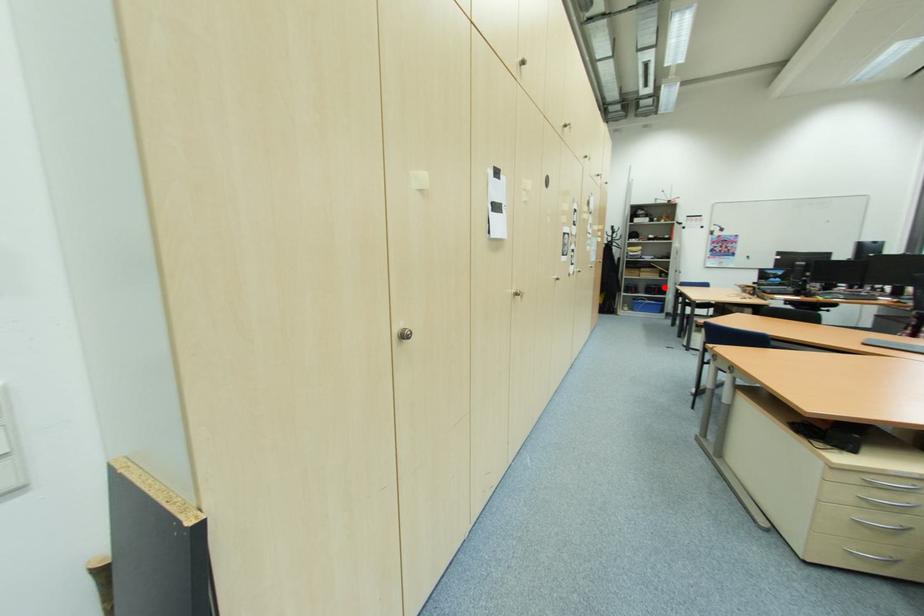
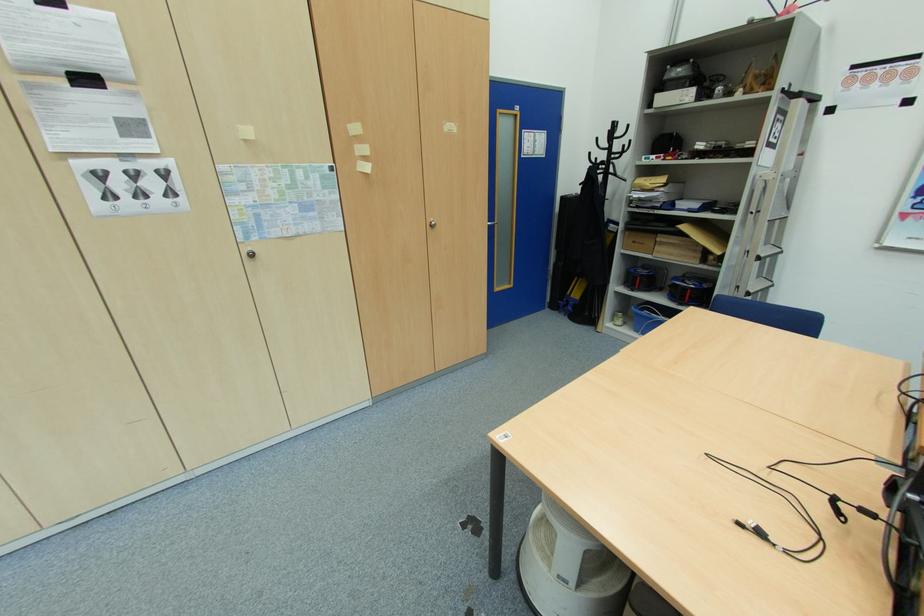
Question: I am providing you with two images of the same scene from different viewpoints. A red point is shown in image1. For the corresponding object point in image2, is it positioned nearer or farther from the camera?

Choices:
 (A) Nearer
 (B) Farther

Answer: (B)